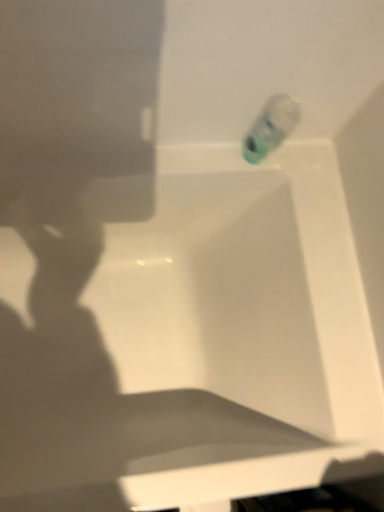
Image resolution: width=384 pixels, height=512 pixels. I want to click on blank area to the left of translucent plastic bottle at upper right, so click(200, 155).